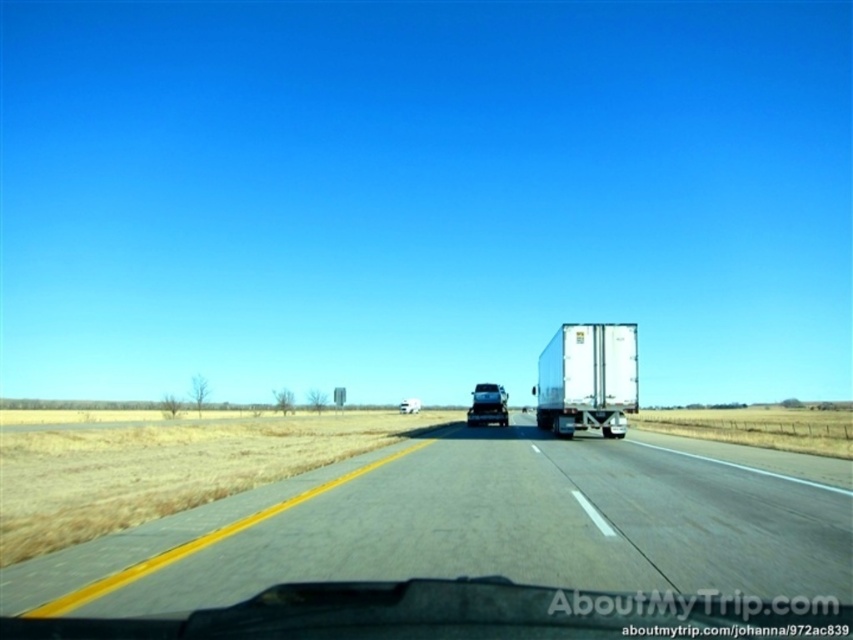
From the picture: You are a passenger in the vehicle and want to describe the position of the gray asphalt highway at center relative to the white glossy trailer truck at center. Based on the scene, what can you say?

The gray asphalt highway at center is located below the white glossy trailer truck at center.

You are a passenger in the car and want to know which of the two points, point (625, 401) or point (408, 404), is closer to the car. Based on the scene description, can you determine which point is closer?

Point (408, 404) is closer to the car because it is behind point (625, 401), which is in front of it.

You are a passenger in the vehicle and notice the gray asphalt highway at center and the white matte truck at center. From your perspective inside the car, which object is positioned to the right of the other?

The gray asphalt highway at center is to the right of the white matte truck at center.